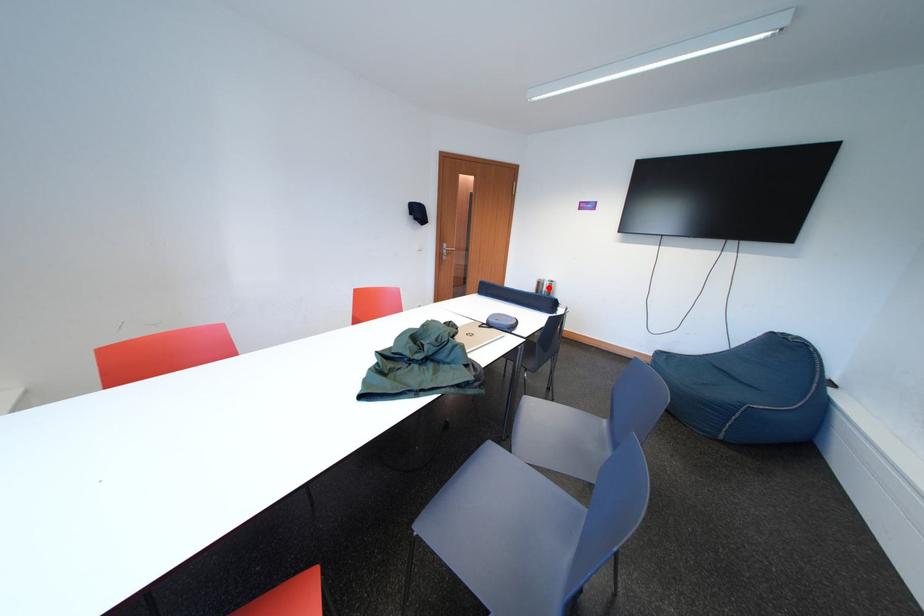
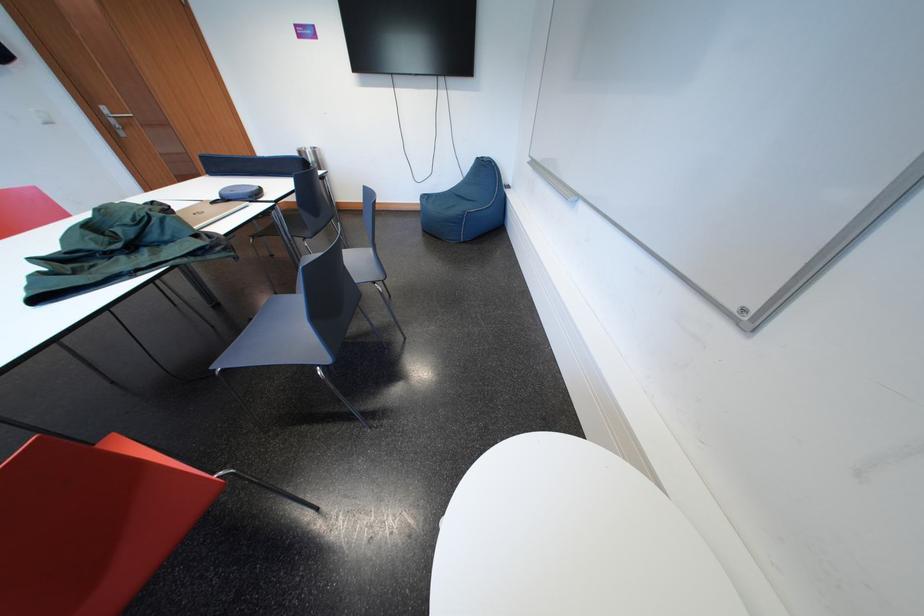
Question: I am providing you with two images of the same scene from different viewpoints. A red point is shown in image1. For the corresponding object point in image2, is it positioned nearer or farther from the camera?

Choices:
 (A) Nearer
 (B) Farther

Answer: (B)